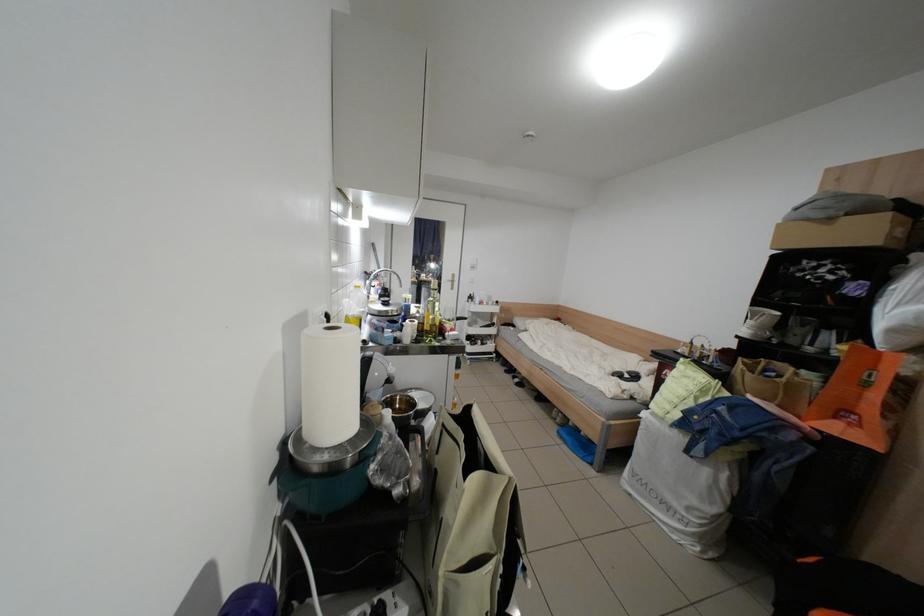
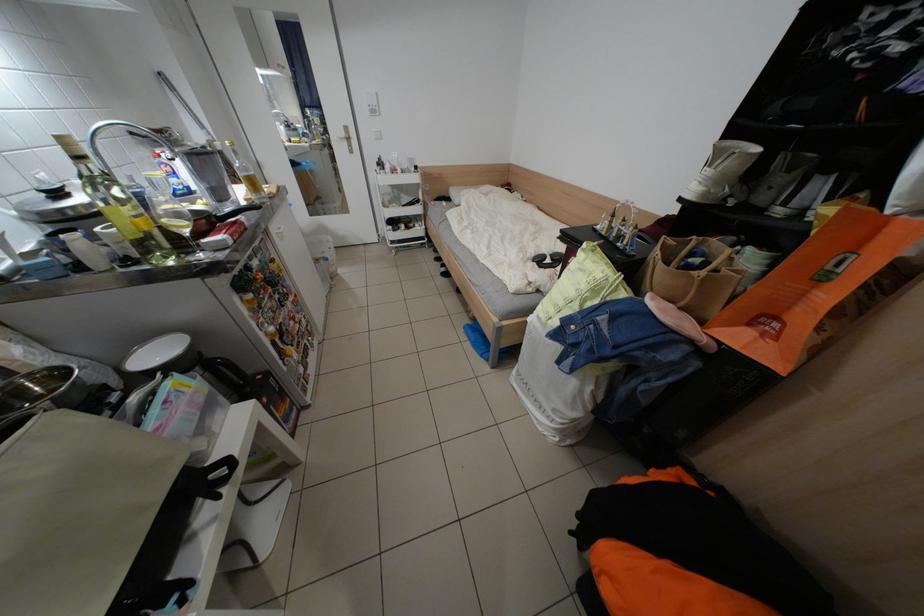
Where in the second image is the point corresponding to point 861,426 from the first image?

(775, 334)